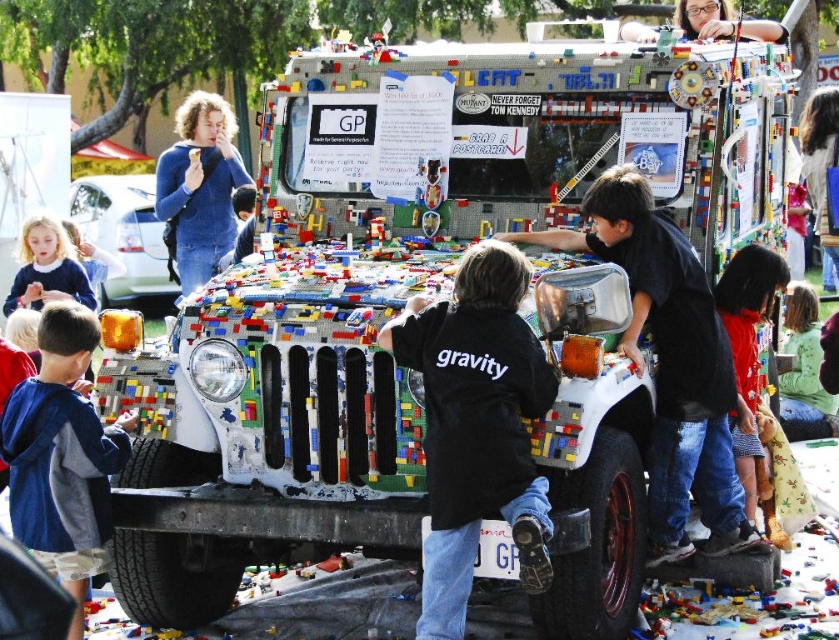
You are a photographer taking a picture of the LEGO Jeep. You notice a black cotton shirt at center and a matte black hair at upper center in your frame. Which object is closer to your camera lens?

The black cotton shirt at center is closer to the viewer than the matte black hair at upper center, so the black cotton shirt at center would appear closer to the camera lens.

You are a photographer trying to capture both the black matte jacket at center and the black cotton shirt at center in a single frame. Which clothing item should you focus on first to ensure both fit in the shot, and why?

You should focus on the black cotton shirt at center first because its width is larger than the black matte jacket at center. By centering the wider item, you can adjust the frame to include both items more easily.